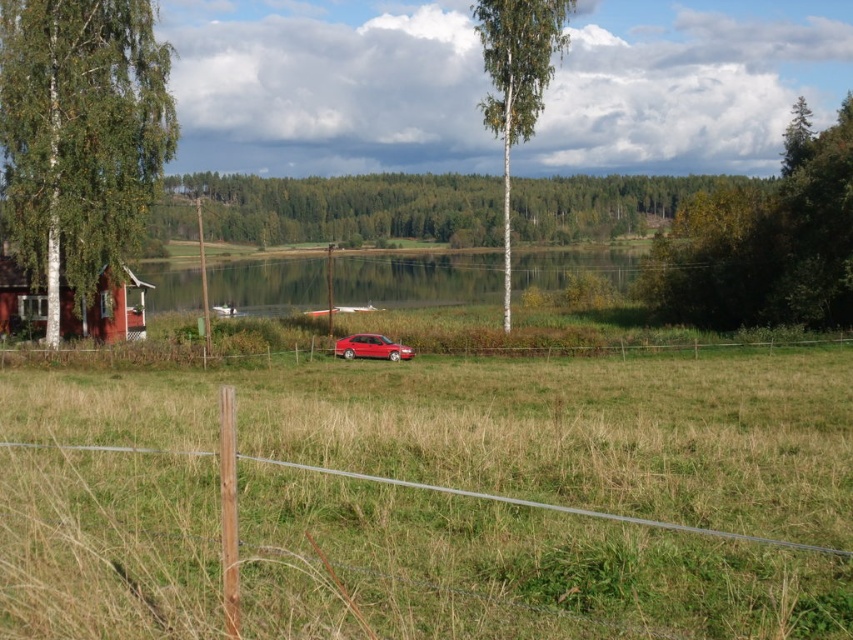
You are a photographer planning to capture a wide shot of the green grass at center and the shiny red sedan at center from the edge of the field. Considering their widths, which object will appear wider in the photo?

The green grass at center will appear wider in the photo because its width surpasses that of the shiny red sedan at center according to the description.

You are standing at the center of the grassy field and want to walk towards the green leafy tree at right. Which direction should you face to head directly towards it?

You should face towards the right direction to head directly towards the green leafy tree at right since it is located at the right side of the scene.

You are standing in the rural landscape scene. There are two points marked in the image. You want to place a small flag at the point that is closer to you. Which point should you choose between point (624,209) and point (680,224)?

Point (680,224) is closer to you than point (624,209), so you should place the flag at point (680,224).